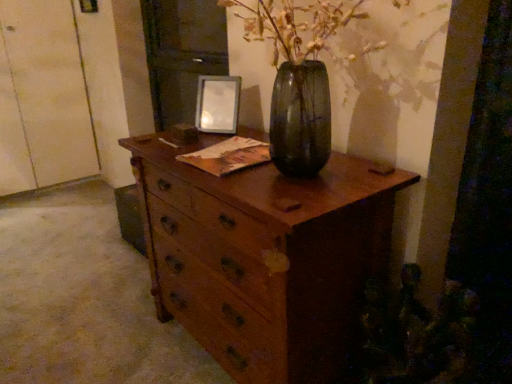
Locate an element on the screen. This screenshot has height=384, width=512. metallic silver picture frame at upper center is located at coordinates (217, 104).

Consider the image. Is white matte door at left facing towards metallic silver picture frame at upper center?

Yes, white matte door at left is aimed at metallic silver picture frame at upper center.

Is white matte door at left in front of or behind metallic silver picture frame at upper center in the image?

white matte door at left is behind metallic silver picture frame at upper center.

Would you say white matte door at left is outside metallic silver picture frame at upper center?

Yes, white matte door at left is outside of metallic silver picture frame at upper center.

Can you tell me how much white matte door at left and metallic silver picture frame at upper center differ in facing direction?

The angle between the facing direction of white matte door at left and the facing direction of metallic silver picture frame at upper center is 55.4 degrees.

Based on the photo, how different are the orientations of metallic silver picture frame at upper center and wooden chest of drawers at center in degrees?

metallic silver picture frame at upper center and wooden chest of drawers at center are facing 35.5 degrees away from each other.

Which object is wider, metallic silver picture frame at upper center or wooden chest of drawers at center?

wooden chest of drawers at center.

Choose the correct answer: Is metallic silver picture frame at upper center inside wooden chest of drawers at center or outside it?

metallic silver picture frame at upper center is not inside wooden chest of drawers at center, it's outside.

I want to click on picture frame above the wooden chest of drawers at center (from the image's perspective), so click(x=217, y=104).

How different are the orientations of wooden chest of drawers at center and white matte door at left in degrees?

91 degrees separate the facing orientations of wooden chest of drawers at center and white matte door at left.

Considering the relative sizes of wooden chest of drawers at center and white matte door at left in the image provided, is wooden chest of drawers at center bigger than white matte door at left?

No, wooden chest of drawers at center is not bigger than white matte door at left.

I want to click on the chest of drawers below the white matte door at left (from the image's perspective), so click(264, 257).

Does wooden chest of drawers at center lie in front of metallic silver picture frame at upper center?

Yes, it is.

From the image's perspective, is wooden chest of drawers at center under metallic silver picture frame at upper center?

Yes, from the image's perspective, wooden chest of drawers at center is below metallic silver picture frame at upper center.

Is wooden chest of drawers at center far from metallic silver picture frame at upper center?

No, wooden chest of drawers at center is not far away from metallic silver picture frame at upper center.

Where is `picture frame on the left of wooden chest of drawers at center`? The height and width of the screenshot is (384, 512). picture frame on the left of wooden chest of drawers at center is located at coordinates (217, 104).

In the scene shown: From a real-world perspective, between white matte door at left and wooden chest of drawers at center, who is vertically lower?

From a 3D spatial view, wooden chest of drawers at center is below.

Considering the positions of objects white matte door at left and wooden chest of drawers at center in the image provided, who is more to the right, white matte door at left or wooden chest of drawers at center?

From the viewer's perspective, wooden chest of drawers at center appears more on the right side.

Is white matte door at left looking in the opposite direction of wooden chest of drawers at center?

No, white matte door at left is not facing the opposite direction of wooden chest of drawers at center.

From the image's perspective, is white matte door at left positioned above or below wooden chest of drawers at center?

Clearly, from the image's perspective, white matte door at left is above wooden chest of drawers at center.

Is metallic silver picture frame at upper center next to white matte door at left?

No, metallic silver picture frame at upper center is not with white matte door at left.

Does metallic silver picture frame at upper center have a greater height compared to white matte door at left?

In fact, metallic silver picture frame at upper center may be shorter than white matte door at left.

Between metallic silver picture frame at upper center and white matte door at left, which one has smaller size?

Smaller between the two is metallic silver picture frame at upper center.

From the image's perspective, is metallic silver picture frame at upper center above white matte door at left?

No, from the image's perspective, metallic silver picture frame at upper center is not over white matte door at left.

I want to click on picture frame that is below the white matte door at left (from the image's perspective), so click(x=217, y=104).

The width and height of the screenshot is (512, 384). What are the coordinates of `picture frame lying behind the wooden chest of drawers at center` in the screenshot? It's located at (217, 104).

Which object lies further to the anchor point wooden chest of drawers at center, metallic silver picture frame at upper center or white matte door at left?

white matte door at left is further to wooden chest of drawers at center.

Which object lies further to the anchor point white matte door at left, wooden chest of drawers at center or metallic silver picture frame at upper center?

The object further to white matte door at left is wooden chest of drawers at center.

Estimate the real-world distances between objects in this image. Which object is closer to metallic silver picture frame at upper center, wooden chest of drawers at center or white matte door at left?

wooden chest of drawers at center lies closer to metallic silver picture frame at upper center than the other object.

From the image, which object appears to be farther from metallic silver picture frame at upper center, white matte door at left or wooden chest of drawers at center?

white matte door at left is further to metallic silver picture frame at upper center.

Estimate the real-world distances between objects in this image. Which object is further from white matte door at left, metallic silver picture frame at upper center or wooden chest of drawers at center?

The object further to white matte door at left is wooden chest of drawers at center.

Which object lies further to the anchor point wooden chest of drawers at center, white matte door at left or metallic silver picture frame at upper center?

The object further to wooden chest of drawers at center is white matte door at left.

I want to click on picture frame located between white matte door at left and wooden chest of drawers at center in the left-right direction, so click(x=217, y=104).